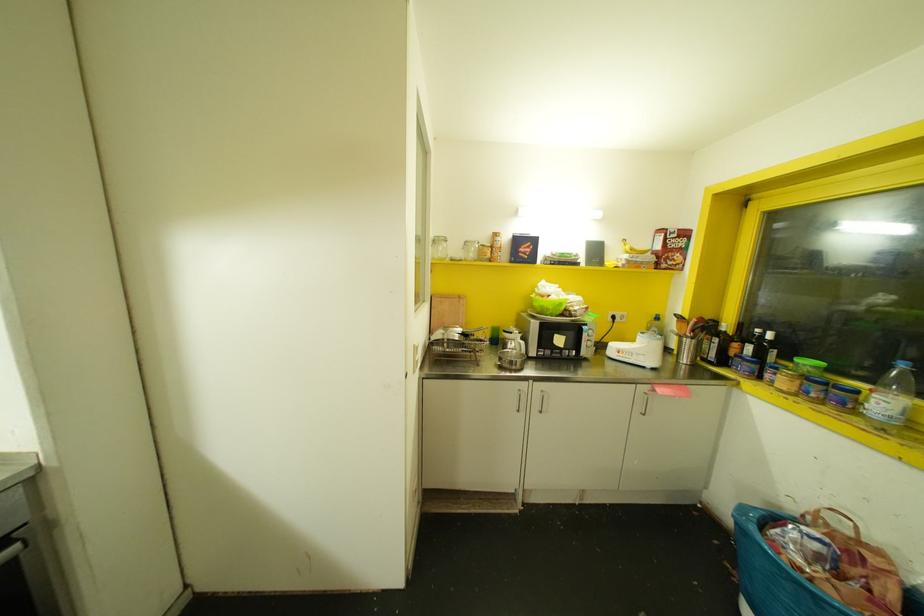
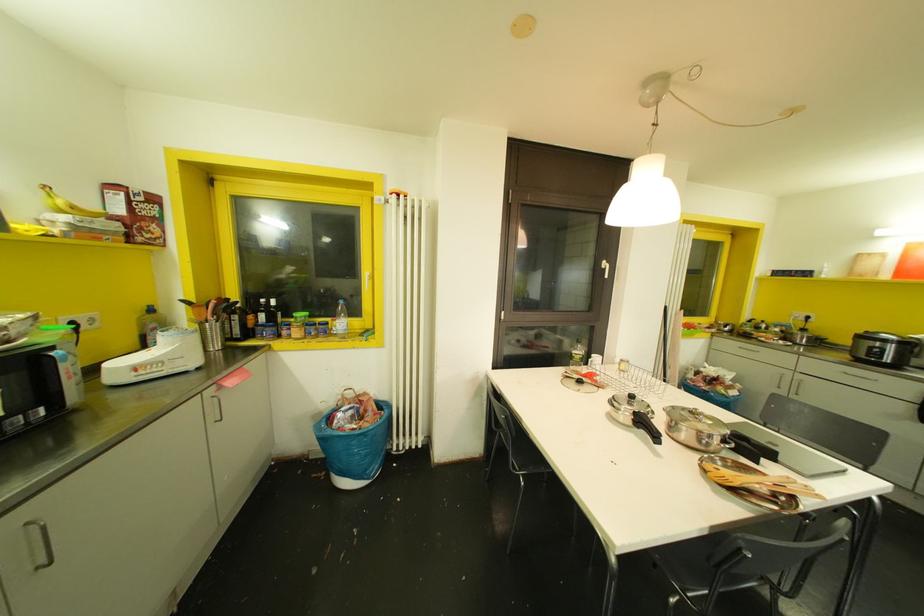
In the second image, find the point that corresponds to the point at 541,411 in the first image.

(49, 562)